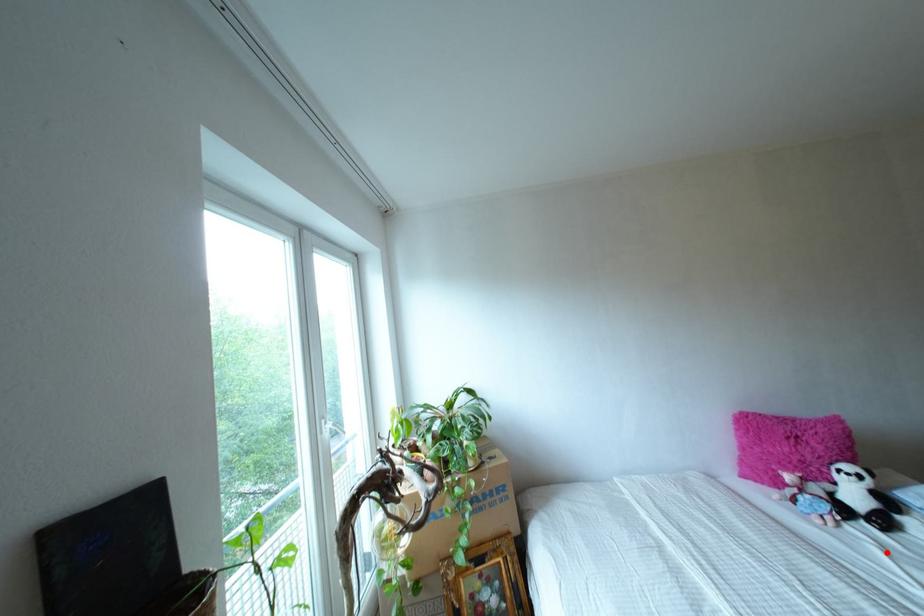
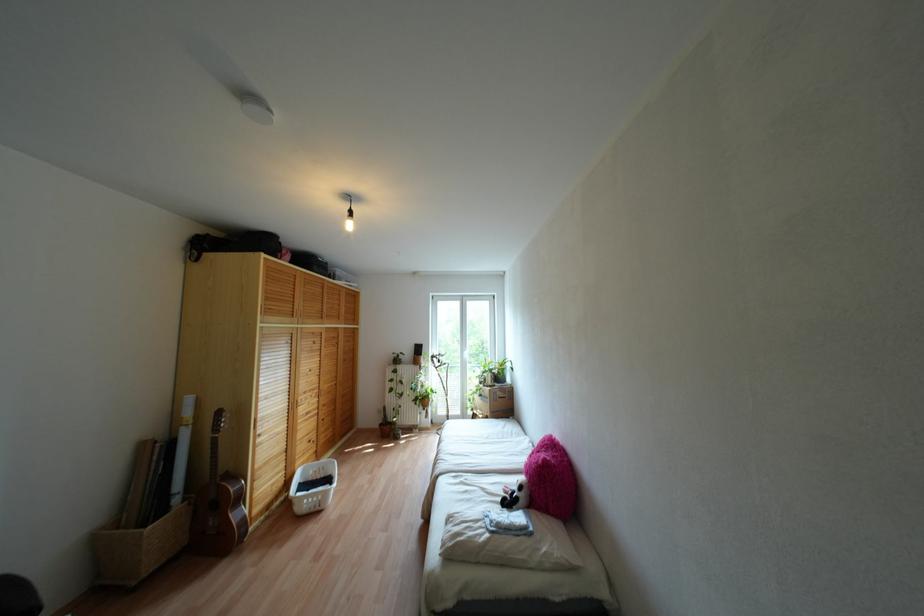
Question: I am providing you with two images of the same scene from different viewpoints. A red point is shown in image1. For the corresponding object point in image2, is it positioned nearer or farther from the camera?

Choices:
 (A) Nearer
 (B) Farther

Answer: (B)